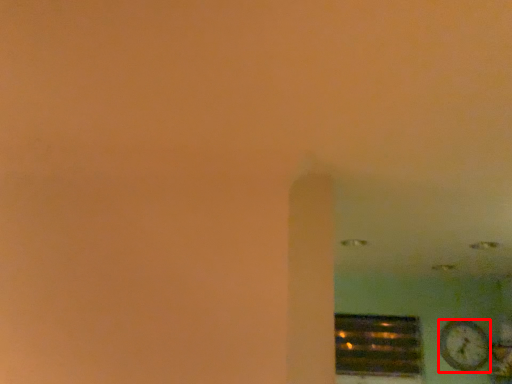
Question: From the image's perspective, considering the relative positions of clock (annotated by the red box) and window in the image provided, where is clock (annotated by the red box) located with respect to the staircase?

Choices:
 (A) above
 (B) below

Answer: (A)